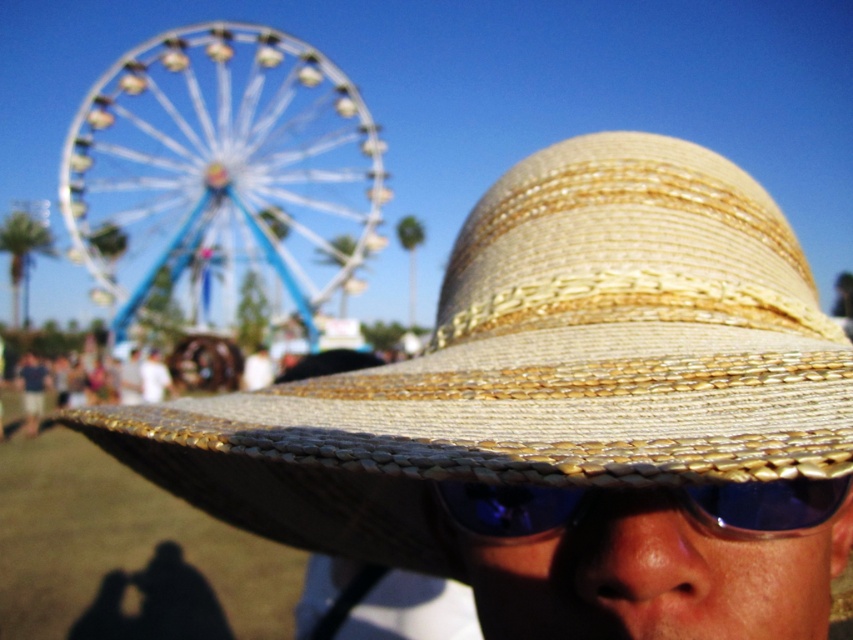
Question: Is the position of metallic blue ferris wheel at upper left more distant than that of blue reflective plastic goggles at center?

Choices:
 (A) yes
 (B) no

Answer: (A)

Question: Which object is closer to the camera taking this photo?

Choices:
 (A) natural straw hat at center
 (B) blue reflective plastic goggles at center
 (C) metallic blue ferris wheel at upper left

Answer: (B)

Question: Which of the following is the farthest from the observer?

Choices:
 (A) metallic blue ferris wheel at upper left
 (B) blue reflective plastic goggles at center

Answer: (A)

Question: Can you confirm if natural straw hat at center is positioned above metallic blue ferris wheel at upper left?

Choices:
 (A) no
 (B) yes

Answer: (A)

Question: Does natural straw hat at center have a smaller size compared to blue reflective plastic goggles at center?

Choices:
 (A) no
 (B) yes

Answer: (A)

Question: Which of the following is the farthest from the observer?

Choices:
 (A) (463, 529)
 (B) (107, 74)
 (C) (552, 378)

Answer: (B)